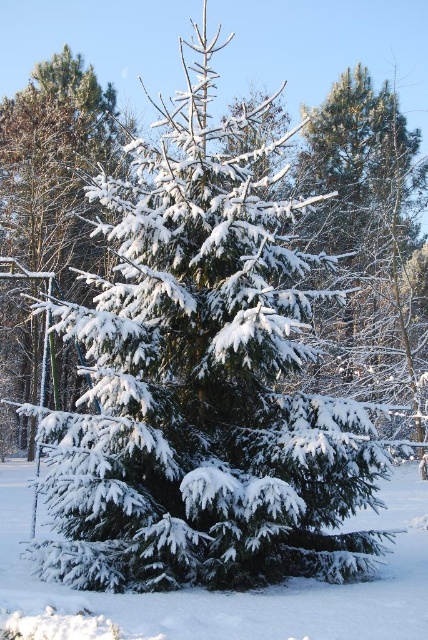
You are an arborist assessing the trees in the winter scene. You need to determine which tree is shorter between the green matte evergreen tree at upper right and the white frosty pine at left. Based on the scene, which one is shorter?

The green matte evergreen tree at upper right is shorter than the white frosty pine at left.

You are a photographer planning to capture the white fluffy snow at center and the white frosty pine at left in a single frame. Based on their sizes, which object should you focus on first to ensure both are in the frame?

The white fluffy snow at center is smaller than the white frosty pine at left, so you should focus on the white frosty pine at left first to ensure both fit in the frame.